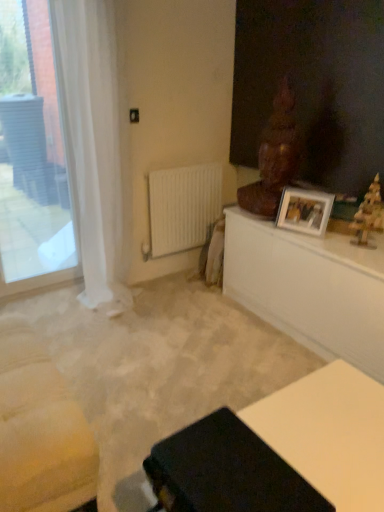
Question: Is white glossy table at upper right, the second table from the front, at the back of wooden christmas tree at right, marked as the first sculpture in a front-to-back arrangement?

Choices:
 (A) no
 (B) yes

Answer: (A)

Question: From a real-world perspective, is wooden christmas tree at right, arranged as the 2th sculpture when viewed from the back, on white glossy table at upper right, the second table from the front?

Choices:
 (A) no
 (B) yes

Answer: (B)

Question: Is wooden christmas tree at right, which is the second sculpture in left-to-right order, next to white glossy table at upper right, the 1th table when ordered from back to front?

Choices:
 (A) no
 (B) yes

Answer: (A)

Question: Does wooden christmas tree at right, arranged as the 2th sculpture when viewed from the back, contain white glossy table at upper right, the second table in the bottom-to-top sequence?

Choices:
 (A) yes
 (B) no

Answer: (B)

Question: From a real-world perspective, is wooden christmas tree at right, the 1th sculpture positioned from the right, beneath white glossy table at upper right, the second table from the front?

Choices:
 (A) no
 (B) yes

Answer: (A)

Question: In the image, is wooden christmas tree at right, arranged as the 2th sculpture when viewed from the back, positioned in front of or behind white glossy table at upper right, the second table from the front?

Choices:
 (A) behind
 (B) front

Answer: (A)

Question: From the image's perspective, is wooden christmas tree at right, the 1th sculpture positioned from the right, located above or below white glossy table at upper right, the second table from the front?

Choices:
 (A) below
 (B) above

Answer: (B)

Question: Would you say wooden christmas tree at right, marked as the first sculpture in a front-to-back arrangement, is inside or outside white glossy table at upper right, which is counted as the 1th table, starting from the top?

Choices:
 (A) outside
 (B) inside

Answer: (A)

Question: Is wooden christmas tree at right, the 1th sculpture positioned from the right, to the left or to the right of white glossy table at upper right, the second table from the front, in the image?

Choices:
 (A) right
 (B) left

Answer: (A)

Question: From the image's perspective, is white glossy picture frame at upper right above or below white glossy table at upper right, the 1th table when ordered from back to front?

Choices:
 (A) below
 (B) above

Answer: (B)

Question: In the image, is white glossy picture frame at upper right positioned in front of or behind white glossy table at upper right, the 1th table when ordered from back to front?

Choices:
 (A) behind
 (B) front

Answer: (A)

Question: Considering the relative positions of white glossy picture frame at upper right and white glossy table at upper right, the 1th table when ordered from back to front, in the image provided, is white glossy picture frame at upper right to the left or to the right of white glossy table at upper right, the 1th table when ordered from back to front,?

Choices:
 (A) right
 (B) left

Answer: (B)

Question: Does point (314, 233) appear closer or farther from the camera than point (258, 229)?

Choices:
 (A) closer
 (B) farther

Answer: (A)

Question: Is point (274, 298) positioned closer to the camera than point (157, 176)?

Choices:
 (A) farther
 (B) closer

Answer: (B)

Question: Considering the positions of white glossy table at upper right, the 1th table when ordered from back to front, and white matte radiator at center in the image, is white glossy table at upper right, the 1th table when ordered from back to front, taller or shorter than white matte radiator at center?

Choices:
 (A) tall
 (B) short

Answer: (B)